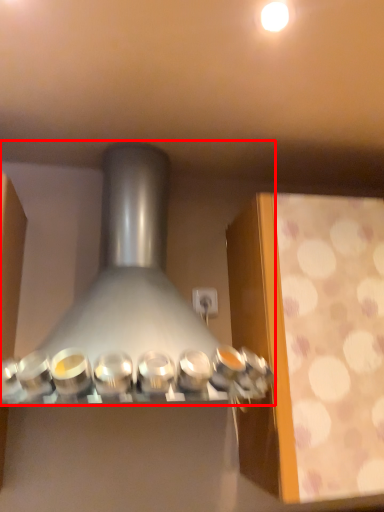
Question: Considering the relative positions of kitchen appliance (annotated by the red box) and lighting in the image provided, where is kitchen appliance (annotated by the red box) located with respect to the staircase?

Choices:
 (A) left
 (B) right

Answer: (A)